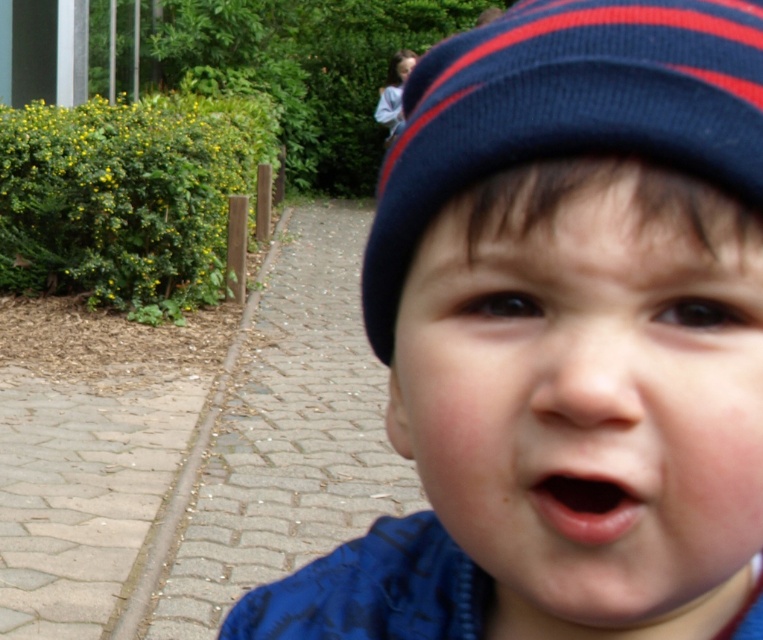
Question: Is blue knit hat at upper right bigger than blue knit cap at upper center?

Choices:
 (A) yes
 (B) no

Answer: (B)

Question: Which point is closer to the camera taking this photo?

Choices:
 (A) (546, 513)
 (B) (684, 120)

Answer: (B)

Question: Can you confirm if blue knit hat at center is positioned above blue knit hat at upper right?

Choices:
 (A) no
 (B) yes

Answer: (A)

Question: Which point is closer to the camera?

Choices:
 (A) blue knit cap at upper center
 (B) blue knit hat at center
 (C) blue knit hat at upper right
 (D) pink smooth lips at center

Answer: (B)

Question: Can you confirm if blue knit hat at upper right is thinner than pink smooth lips at center?

Choices:
 (A) yes
 (B) no

Answer: (B)

Question: Which point is closer to the camera taking this photo?

Choices:
 (A) (645, 12)
 (B) (539, 499)
 (C) (665, 285)
 (D) (506, 550)

Answer: (C)